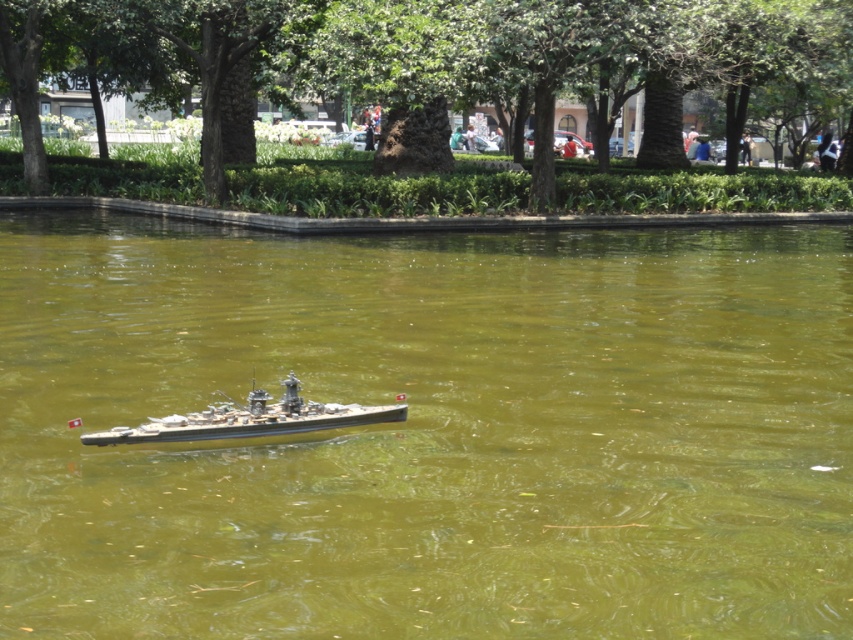
You are a photographer trying to capture the metallic gray ship at center in your shot. However, you notice the green murky water at center is blocking your view. Can you adjust your position to see the ship clearly?

The green murky water at center is in front of the metallic gray ship at center, so you need to move your position to avoid the water blocking the view of the ship.

Consider the image. You are a photographer trying to capture the metallic gray ship at center in the image. Since the green murky water at center is wider than the ship, where should you position your camera to ensure the ship is fully visible without cropping any part of it?

Since the green murky water at center is wider than the metallic gray ship at center, you should position your camera to focus on the central area of the green murky water at center to ensure the entire metallic gray ship at center is visible without cropping.